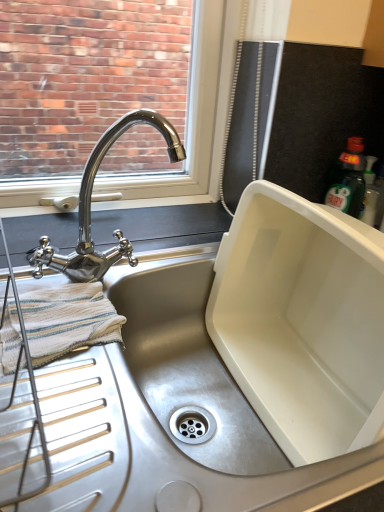
This screenshot has height=512, width=384. Describe the element at coordinates (68, 320) in the screenshot. I see `white striped cloth at left` at that location.

Find the location of a particular element. Image resolution: width=384 pixels, height=512 pixels. white striped cloth at left is located at coordinates (68, 320).

The width and height of the screenshot is (384, 512). What do you see at coordinates (90, 207) in the screenshot?
I see `polished chrome tap at upper left` at bounding box center [90, 207].

Locate an element on the screen. The width and height of the screenshot is (384, 512). polished chrome tap at upper left is located at coordinates (90, 207).

Image resolution: width=384 pixels, height=512 pixels. I want to click on white striped cloth at left, so click(x=68, y=320).

Can you confirm if polished chrome tap at upper left is positioned to the left of white striped cloth at left?

Incorrect, polished chrome tap at upper left is not on the left side of white striped cloth at left.

Is the position of polished chrome tap at upper left more distant than that of white striped cloth at left?

No.

Between point (95, 170) and point (45, 351), which one is positioned behind?

Positioned behind is point (95, 170).

From the image's perspective, which object appears higher, polished chrome tap at upper left or white striped cloth at left?

polished chrome tap at upper left.

From a real-world perspective, who is located lower, polished chrome tap at upper left or white striped cloth at left?

white striped cloth at left.

Which object is wider, polished chrome tap at upper left or white striped cloth at left?

polished chrome tap at upper left.

Considering the sizes of polished chrome tap at upper left and white striped cloth at left in the image, is polished chrome tap at upper left taller or shorter than white striped cloth at left?

polished chrome tap at upper left is taller than white striped cloth at left.

Is polished chrome tap at upper left smaller than white striped cloth at left?

Incorrect, polished chrome tap at upper left is not smaller in size than white striped cloth at left.

Is white striped cloth at left located within polished chrome tap at upper left?

Actually, white striped cloth at left is outside polished chrome tap at upper left.

Is polished chrome tap at upper left positioned far away from white striped cloth at left?

That's not correct — polished chrome tap at upper left is a little close to white striped cloth at left.

Could you tell me if polished chrome tap at upper left is turned towards white striped cloth at left?

No, polished chrome tap at upper left is not oriented towards white striped cloth at left.

What's the angular difference between polished chrome tap at upper left and white striped cloth at left's facing directions?

There is a 0.000859-degree angle between the facing directions of polished chrome tap at upper left and white striped cloth at left.

Locate an element on the screen. Image resolution: width=384 pixels, height=512 pixels. bath towel lying behind the polished chrome tap at upper left is located at coordinates (68, 320).

Considering the positions of objects white striped cloth at left and polished chrome tap at upper left in the image provided, who is more to the left, white striped cloth at left or polished chrome tap at upper left?

white striped cloth at left is more to the left.

Does white striped cloth at left lie in front of polished chrome tap at upper left?

That is False.

Considering the points (99, 328) and (122, 245), which point is behind, point (99, 328) or point (122, 245)?

The point (122, 245) is more distant.

From the image's perspective, between white striped cloth at left and polished chrome tap at upper left, who is located below?

white striped cloth at left, from the image's perspective.

From a real-world perspective, which is physically above, white striped cloth at left or polished chrome tap at upper left?

polished chrome tap at upper left, from a real-world perspective.

Which object is wider, white striped cloth at left or polished chrome tap at upper left?

With larger width is polished chrome tap at upper left.

Between white striped cloth at left and polished chrome tap at upper left, which one has less height?

Standing shorter between the two is white striped cloth at left.

Considering the sizes of objects white striped cloth at left and polished chrome tap at upper left in the image provided, who is bigger, white striped cloth at left or polished chrome tap at upper left?

With larger size is polished chrome tap at upper left.

In the scene shown: Can we say white striped cloth at left lies outside polished chrome tap at upper left?

Yes, white striped cloth at left is outside of polished chrome tap at upper left.

Are white striped cloth at left and polished chrome tap at upper left making contact?

No, white striped cloth at left is not in contact with polished chrome tap at upper left.

Could you tell me if white striped cloth at left is turned towards polished chrome tap at upper left?

Yes.

How far apart are white striped cloth at left and polished chrome tap at upper left?

white striped cloth at left and polished chrome tap at upper left are 5.55 inches apart.

In order to click on bath towel that appears below the polished chrome tap at upper left (from the image's perspective) in this screenshot , I will do (68, 320).

The width and height of the screenshot is (384, 512). I want to click on tap located above the white striped cloth at left (from a real-world perspective), so click(x=90, y=207).

In order to click on bath towel below the polished chrome tap at upper left (from the image's perspective) in this screenshot , I will do `click(68, 320)`.